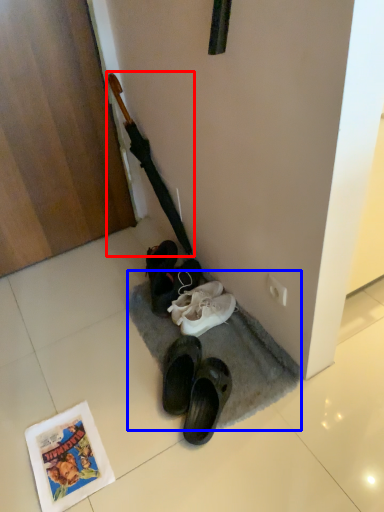
Question: Which point is further to the camera, crucifix (highlighted by a red box) or doormat (highlighted by a blue box)?

Choices:
 (A) crucifix
 (B) doormat

Answer: (A)